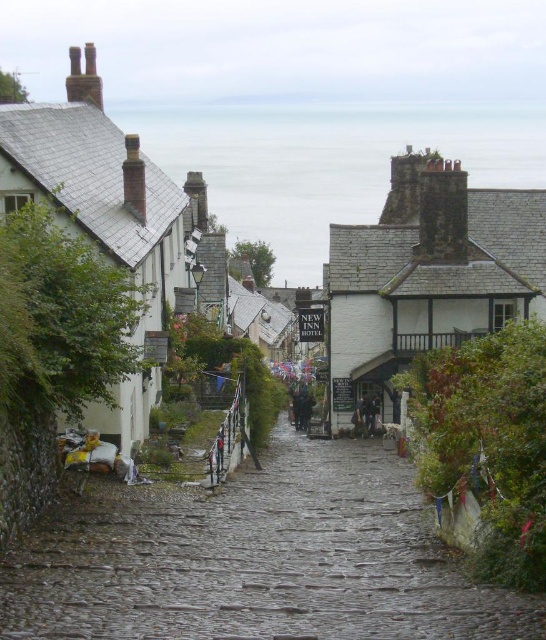
Question: Among these objects, which one is farthest from the camera?

Choices:
 (A) cobblestone path at center
 (B) white stone village at center

Answer: (B)

Question: Is cobblestone path at center to the right of white stone village at center from the viewer's perspective?

Choices:
 (A) yes
 (B) no

Answer: (B)

Question: Which of the following is the farthest from the observer?

Choices:
 (A) cobblestone path at center
 (B) white stone village at center

Answer: (B)

Question: Can you confirm if cobblestone path at center is smaller than white stone village at center?

Choices:
 (A) no
 (B) yes

Answer: (B)

Question: From the image, what is the correct spatial relationship of cobblestone path at center in relation to white stone village at center?

Choices:
 (A) right
 (B) left

Answer: (B)